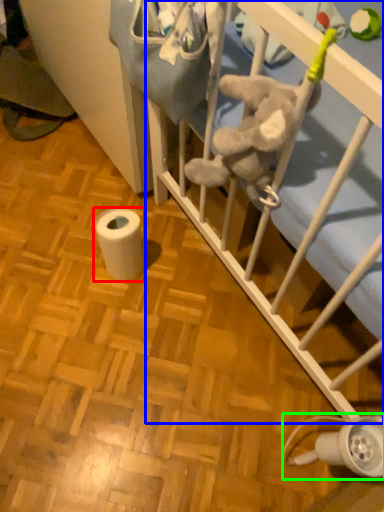
Question: Based on their relative distances, which object is nearer to toilet paper (highlighted by a red box)? Choose from infant bed (highlighted by a blue box) and lamp (highlighted by a green box).

Choices:
 (A) infant bed
 (B) lamp

Answer: (A)